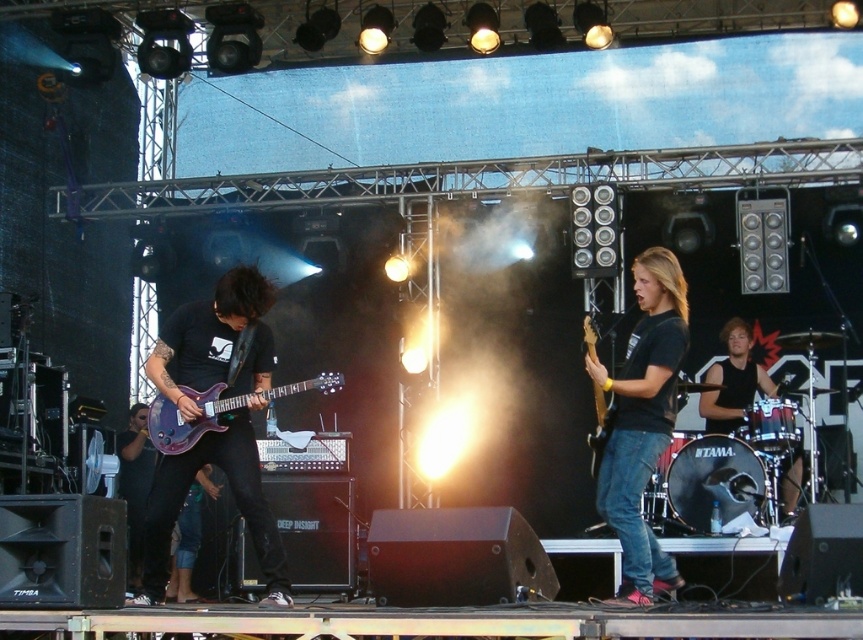
You are a photographer at the live music performance. You want to capture a photo of both the black matte shirt at center and the black sleeveless shirt at center. Which one should you focus on first if you want to include both in the frame without moving the camera?

The black matte shirt at center is to the left of black sleeveless shirt at center, so you should focus on the black matte shirt at center first to ensure both are in the frame without moving the camera.